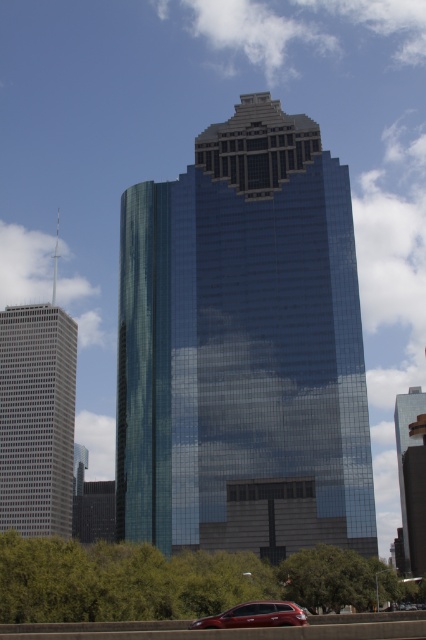
From the picture: You are standing in front of the gray glass skyscraper at left and want to take a photo of it from a distance where it appears half the size of the central skyscraper. Given that the central skyscraper is 929.98 feet tall, what distance should you move to achieve this?

The gray glass skyscraper at left is currently 464.99 feet away. To make it appear half the size of the central skyscraper, you need to double the distance. Therefore, you should move to 929.98 feet away from the gray glass skyscraper at left.

You are an architect evaluating two glass skyscrapers in the city. The first is the shiny glass skyscraper at center, and the second is the shiny glass skyscraper at right. Based on their architectural designs, which one do you think is taller?

The shiny glass skyscraper at center is taller than the shiny glass skyscraper at right.

You are a photographer standing at the base of the shiny glass skyscraper at center. You want to take a photo of the shiny metallic car at lower center without the skyscraper blocking the view. Is this possible given their relative heights?

The shiny glass skyscraper at center is taller than the shiny metallic car at lower center. Since you are at the base of the skyscraper, its height would likely block the view of the car unless you move to a position where the car is not directly behind the skyscraper.